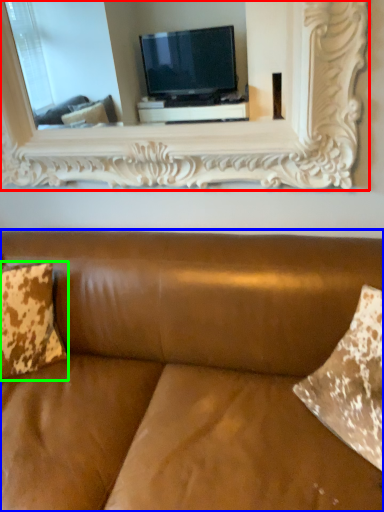
Question: Considering the real-world distances, which object is closest to picture frame (highlighted by a red box)? studio couch (highlighted by a blue box) or pillow (highlighted by a green box).

Choices:
 (A) studio couch
 (B) pillow

Answer: (A)